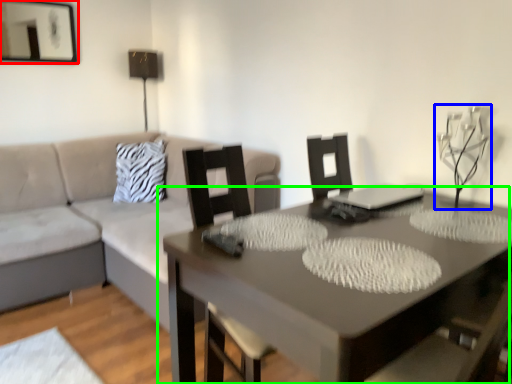
Question: Which object is the closest to the picture frame (highlighted by a red box)? Choose among these: candle holder (highlighted by a blue box) or table (highlighted by a green box).

Choices:
 (A) candle holder
 (B) table

Answer: (B)